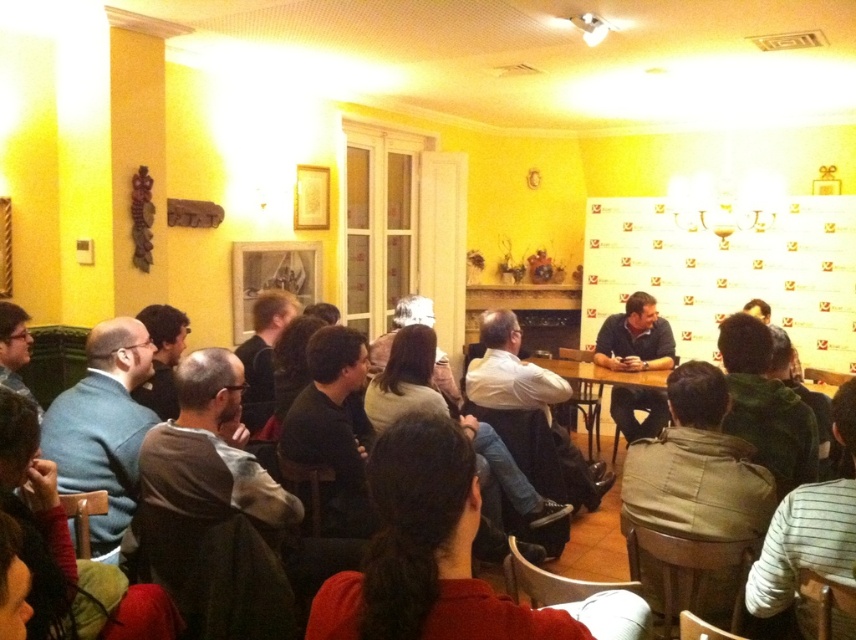
You are a guest at this event and want to approach the person in the dark blue shirt at center to ask a question. The wooden table at center is between you and them. Can you walk around the table to reach them?

The wooden table at center is behind dark blue shirt at center, so the table is not blocking your path. You can approach the person in the dark blue shirt at center directly without needing to go around the table.

You are organizing a small event in this room and need to place a 15 cm wide decorative item between the dark blue shirt at center and the wooden table at center. Is there enough space for it?

The dark blue shirt at center is thinner than the wooden table at center, so there is sufficient space to place a 15 cm wide decorative item between them.

You are a guest at this event and want to approach the person in the dark blue shirt at center to ask a question. The wooden table at center is between you and them. How can you navigate around the table to reach them?

The dark blue shirt at center is below the wooden table at center, so you can approach them by going around the table on either side since the person is positioned beneath the table.